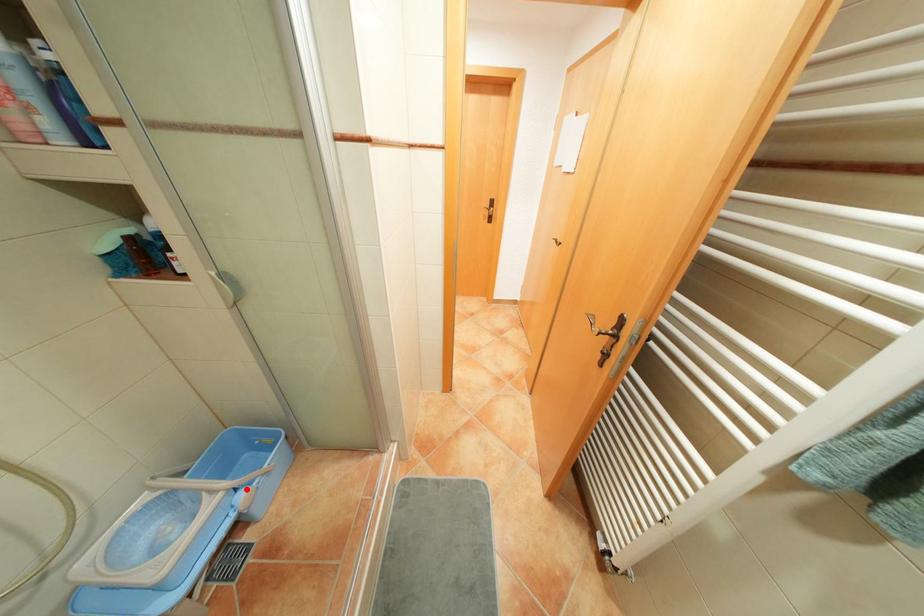
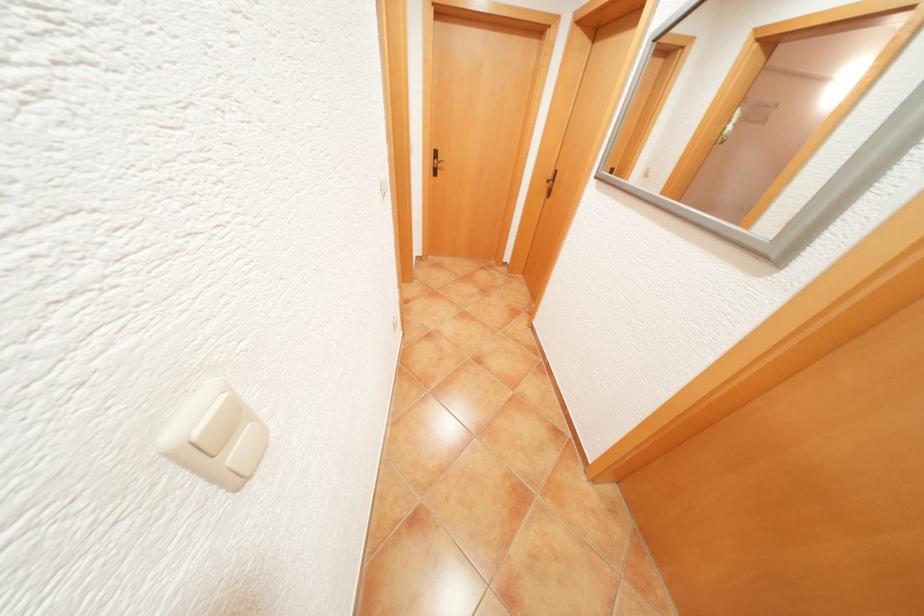
Question: I am providing you with two images of the same scene from different viewpoints. A red point is marked on the first image. Can you still see the location of the red point in image 2?

Choices:
 (A) Yes
 (B) No

Answer: (B)